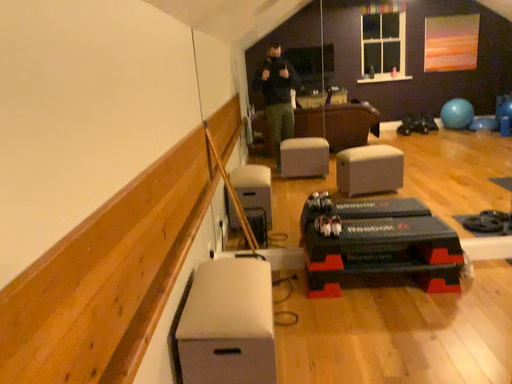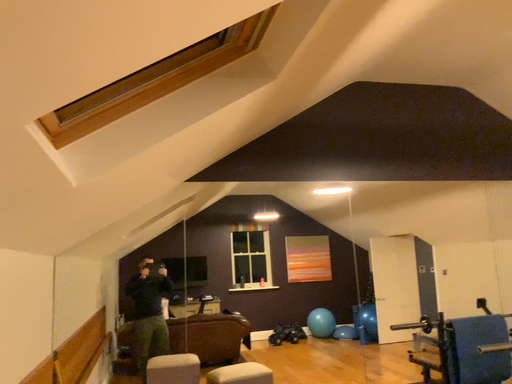
Question: How did the camera likely rotate when shooting the video?

Choices:
 (A) rotated left
 (B) rotated right

Answer: (B)